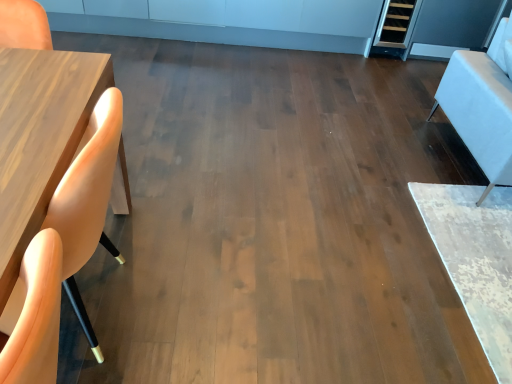
What do you see at coordinates (87, 201) in the screenshot? This screenshot has height=384, width=512. I see `matte wood chair at left` at bounding box center [87, 201].

Measure the distance between point (20, 278) and camera.

Point (20, 278) and camera are 34.88 inches apart from each other.

Locate an element on the screen. The height and width of the screenshot is (384, 512). matte wood chair at left is located at coordinates (87, 201).

Where is `white leather armchair at right`? white leather armchair at right is located at coordinates (482, 105).

This screenshot has height=384, width=512. What do you see at coordinates (482, 105) in the screenshot? I see `white leather armchair at right` at bounding box center [482, 105].

Where is `matte wood chair at left`? matte wood chair at left is located at coordinates (87, 201).

Which object is positioned more to the left, matte wood chair at left or white leather armchair at right?

matte wood chair at left.

Considering their positions, is matte wood chair at left located in front of or behind white leather armchair at right?

Clearly, matte wood chair at left is in front of white leather armchair at right.

Considering the positions of points (114, 96) and (511, 139), is point (114, 96) farther from camera compared to point (511, 139)?

No, (114, 96) is in front of (511, 139).

From the image's perspective, is matte wood chair at left above or below white leather armchair at right?

matte wood chair at left is below white leather armchair at right.

From a real-world perspective, is matte wood chair at left physically located above or below white leather armchair at right?

matte wood chair at left is below white leather armchair at right.

In terms of width, does matte wood chair at left look wider or thinner when compared to white leather armchair at right?

Considering their sizes, matte wood chair at left looks slimmer than white leather armchair at right.

Is matte wood chair at left shorter than white leather armchair at right?

Yes.

Does matte wood chair at left have a smaller size compared to white leather armchair at right?

Indeed, matte wood chair at left has a smaller size compared to white leather armchair at right.

Is matte wood chair at left inside the boundaries of white leather armchair at right, or outside?

matte wood chair at left lies outside white leather armchair at right.

Is matte wood chair at left in contact with white leather armchair at right?

No, matte wood chair at left is not beside white leather armchair at right.

Is matte wood chair at left turned away from white leather armchair at right?

No, matte wood chair at left is not facing the opposite direction of white leather armchair at right.

At what (x,y) coordinates should I click in order to perform the action: click on armchair above the matte wood chair at left (from a real-world perspective). Please return your answer as a coordinate pair (x, y). This screenshot has height=384, width=512. Looking at the image, I should click on (482, 105).

Between white leather armchair at right and matte wood chair at left, which one appears on the right side from the viewer's perspective?

white leather armchair at right.

Which is behind, white leather armchair at right or matte wood chair at left?

Positioned behind is white leather armchair at right.

From the picture: Which is further, (443,89) or (92,192)?

The point (443,89) is farther.

From the image's perspective, would you say white leather armchair at right is positioned over matte wood chair at left?

Yes, from the image's perspective, white leather armchair at right is on top of matte wood chair at left.

From a real-world perspective, who is located lower, white leather armchair at right or matte wood chair at left?

matte wood chair at left is physically lower.

Considering the relative sizes of white leather armchair at right and matte wood chair at left in the image provided, is white leather armchair at right thinner than matte wood chair at left?

Incorrect, the width of white leather armchair at right is not less than that of matte wood chair at left.

From their relative heights in the image, would you say white leather armchair at right is taller or shorter than matte wood chair at left?

white leather armchair at right is taller than matte wood chair at left.

Is white leather armchair at right bigger or smaller than matte wood chair at left?

In the image, white leather armchair at right appears to be larger than matte wood chair at left.

Consider the image. Is white leather armchair at right not inside matte wood chair at left?

Yes, white leather armchair at right is outside of matte wood chair at left.

Are white leather armchair at right and matte wood chair at left located far from each other?

Yes.

Is matte wood chair at left at the back of white leather armchair at right?

No.

Measure the distance between white leather armchair at right and matte wood chair at left.

A distance of 2.00 meters exists between white leather armchair at right and matte wood chair at left.

Image resolution: width=512 pixels, height=384 pixels. Identify the location of armchair that is on the right side of matte wood chair at left. (482, 105).

Where is `armchair that appears above the matte wood chair at left (from a real-world perspective)`? The height and width of the screenshot is (384, 512). armchair that appears above the matte wood chair at left (from a real-world perspective) is located at coordinates (482, 105).

This screenshot has height=384, width=512. In order to click on armchair that appears behind the matte wood chair at left in this screenshot , I will do `click(482, 105)`.